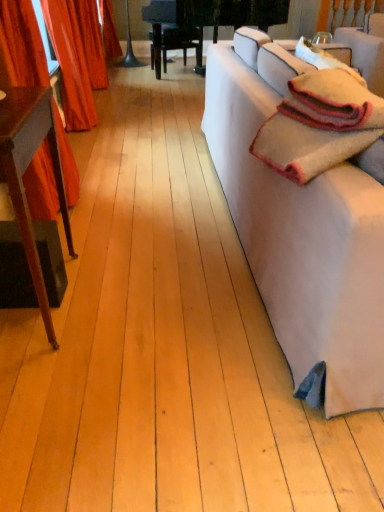
Question: Is mahogany wood table at left inside or outside of soft woolen blanket at right?

Choices:
 (A) inside
 (B) outside

Answer: (B)

Question: Considering the relative positions of mahogany wood table at left and soft woolen blanket at right in the image provided, is mahogany wood table at left to the left or to the right of soft woolen blanket at right?

Choices:
 (A) right
 (B) left

Answer: (B)

Question: Which of these objects is positioned closest to the soft woolen blanket at right?

Choices:
 (A) velvet red curtain at left, the first curtain when ordered from back to front
 (B) white fabric couch at right
 (C) mahogany wood table at left
 (D) velvet red curtain at left, the second curtain when ordered from back to front

Answer: (B)

Question: Considering the real-world distances, which object is closest to the soft woolen blanket at right?

Choices:
 (A) velvet red curtain at left, marked as the 2th curtain in a front-to-back arrangement
 (B) mahogany wood table at left
 (C) velvet red curtain at left, marked as the 1th curtain in a front-to-back arrangement
 (D) white fabric couch at right

Answer: (D)